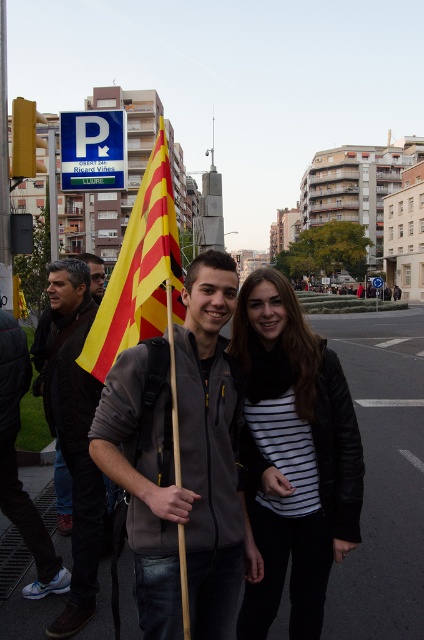
Does matte gray hoodie at center have a greater height compared to yellowstriped fabricflag at left?

Incorrect, matte gray hoodie at center's height is not larger of yellowstriped fabricflag at left's.

Does matte gray hoodie at center appear on the left side of yellowstriped fabricflag at left?

In fact, matte gray hoodie at center is to the right of yellowstriped fabricflag at left.

Who is more forward, (x=148, y=492) or (x=172, y=195)?

Point (x=148, y=492) is more forward.

Identify the location of matte gray hoodie at center. (183, 467).

Between point (94, 401) and point (153, 241), which one is positioned behind?

Positioned behind is point (94, 401).

Find the location of a particular element. This screenshot has width=424, height=640. dark gray jacket at center is located at coordinates [x=74, y=429].

The image size is (424, 640). In order to click on dark gray jacket at center in this screenshot , I will do `click(74, 429)`.

Who is shorter, striped fabric shirt at center or dark gray jacket at center?

striped fabric shirt at center is shorter.

Looking at this image, does striped fabric shirt at center have a larger size compared to dark gray jacket at center?

No.

Who is more forward, (x=328, y=554) or (x=47, y=634)?

Positioned in front is point (x=328, y=554).

The height and width of the screenshot is (640, 424). In order to click on striped fabric shirt at center in this screenshot , I will do `click(293, 456)`.